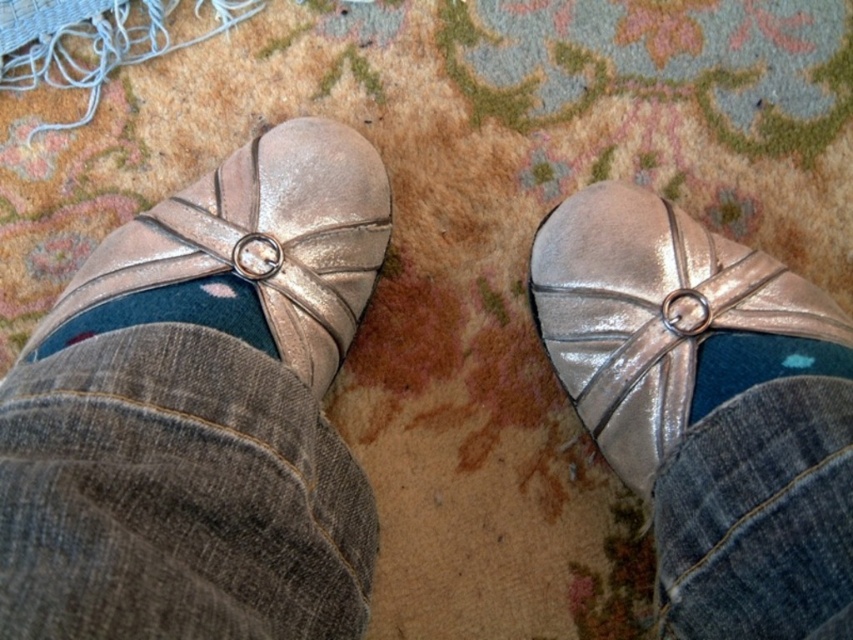
Does shiny metallic shoe at center have a smaller size compared to metallic leather shoe at left?

Indeed, shiny metallic shoe at center has a smaller size compared to metallic leather shoe at left.

Can you confirm if shiny metallic shoe at center is positioned above metallic leather shoe at left?

Incorrect, shiny metallic shoe at center is not positioned above metallic leather shoe at left.

Which is behind, point (787, 316) or point (137, 220)?

Positioned behind is point (137, 220).

Locate an element on the screen. The image size is (853, 640). shiny metallic shoe at center is located at coordinates (651, 312).

At what (x,y) coordinates should I click in order to perform the action: click on shiny metallic shoe at center. Please return your answer as a coordinate pair (x, y). This screenshot has height=640, width=853. Looking at the image, I should click on (651, 312).

Image resolution: width=853 pixels, height=640 pixels. In order to click on shiny metallic shoe at center in this screenshot , I will do `click(651, 312)`.

Can you confirm if metallic leather shoe at left is positioned to the left of blue denim sock at right?

Indeed, metallic leather shoe at left is positioned on the left side of blue denim sock at right.

The image size is (853, 640). I want to click on metallic leather shoe at left, so click(x=259, y=243).